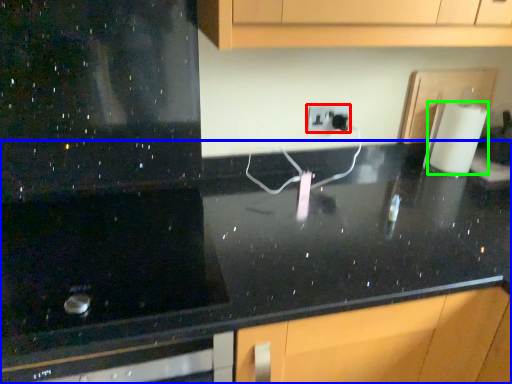
Question: Which object is the closest to the electric outlet (highlighted by a red box)? Choose among these: countertop (highlighted by a blue box) or paper towel (highlighted by a green box).

Choices:
 (A) countertop
 (B) paper towel

Answer: (B)